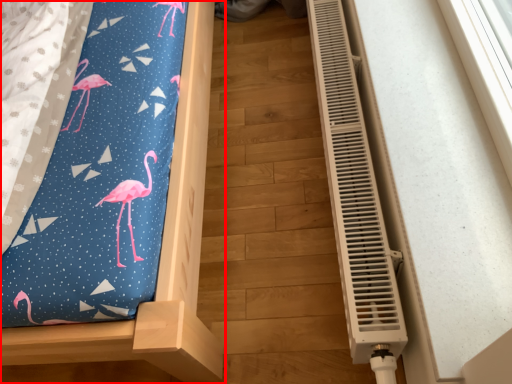
Question: From the image's perspective, where is furniture (annotated by the red box) located relative to air conditioning?

Choices:
 (A) above
 (B) below

Answer: (A)